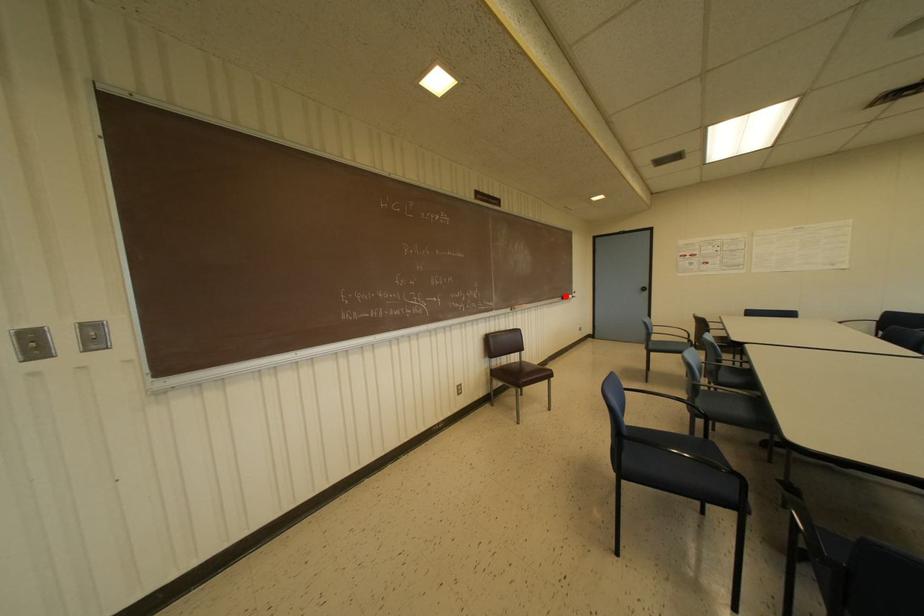
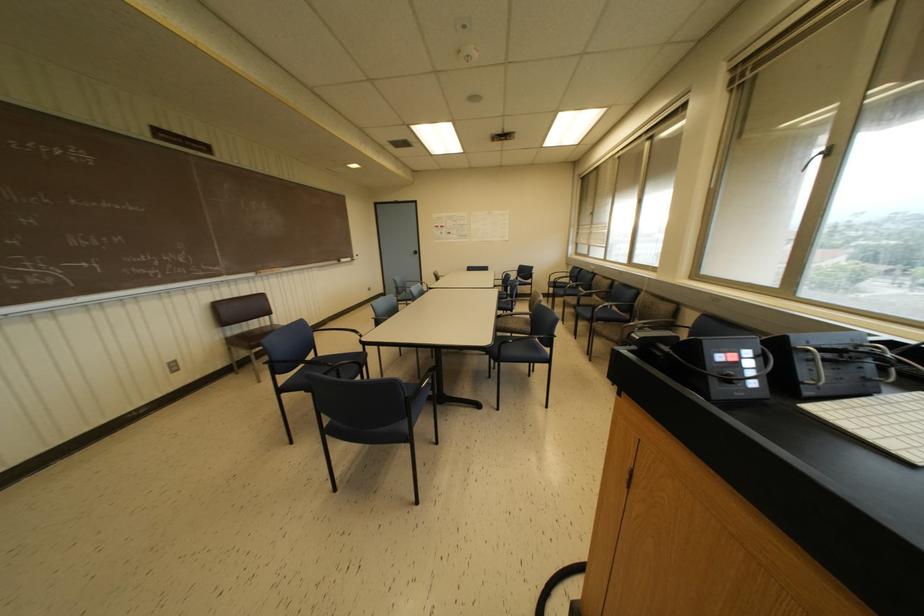
Locate, in the second image, the point that corresponds to the highlighted location in the first image.

(342, 259)